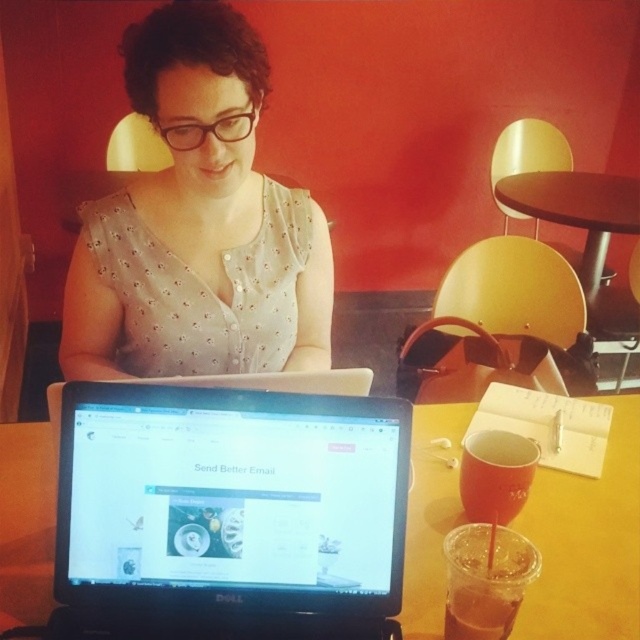
Does point (237, 368) lie in front of point (595, 291)?

That is True.

Between point (326, 256) and point (627, 224), which one is positioned behind?

Positioned behind is point (627, 224).

You are a GUI agent. You are given a task and a screenshot of the screen. Output one action in this format:
    pyautogui.click(x=<x>, y=<y>)
    Task: Click on the matte white blouse at center
    The image size is (640, 640).
    Given the screenshot: What is the action you would take?
    pyautogui.click(x=198, y=224)

Is point (163, 464) positioned after point (602, 268)?

No, (163, 464) is in front of (602, 268).

Does black matte laptop at lower center have a lesser height compared to brown wooden table at upper right?

Correct, black matte laptop at lower center is not as tall as brown wooden table at upper right.

What are the coordinates of `black matte laptop at lower center` in the screenshot? It's located at (230, 509).

Does point (83, 406) come in front of point (454, 621)?

Yes.

Does black matte laptop at lower center appear on the left side of translucent plastic cup at lower center?

Indeed, black matte laptop at lower center is positioned on the left side of translucent plastic cup at lower center.

The height and width of the screenshot is (640, 640). What do you see at coordinates (230, 509) in the screenshot?
I see `black matte laptop at lower center` at bounding box center [230, 509].

Find the location of `black matte laptop at lower center`. black matte laptop at lower center is located at coordinates (230, 509).